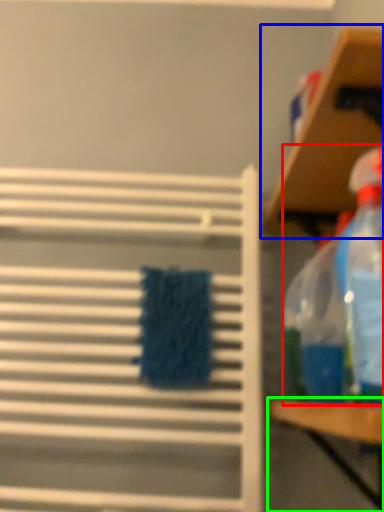
Question: Based on their relative distances, which object is nearer to cleaning product (highlighted by a red box)? Choose from shelf (highlighted by a blue box) and table (highlighted by a green box).

Choices:
 (A) shelf
 (B) table

Answer: (B)